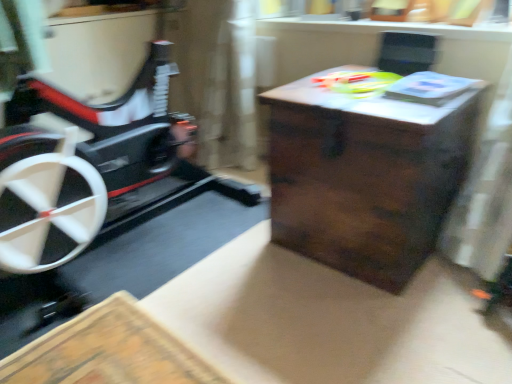
You are a GUI agent. You are given a task and a screenshot of the screen. Output one action in this format:
    pyautogui.click(x=<x>, y=<y>)
    Task: Click on the vacant area on top of dark wood table at center (from a real-world perspective)
    
    Given the screenshot: What is the action you would take?
    pyautogui.click(x=371, y=89)